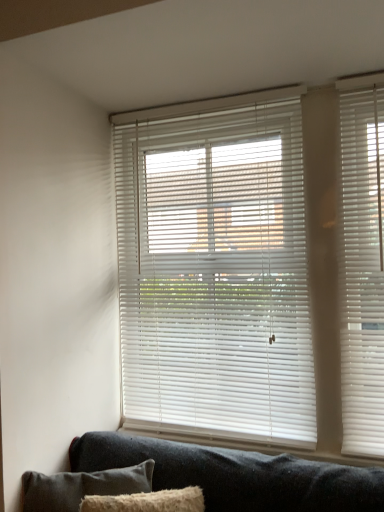
The image size is (384, 512). Describe the element at coordinates (215, 268) in the screenshot. I see `white plastic blinds at center` at that location.

Locate an element on the screen. This screenshot has width=384, height=512. white plastic blinds at center is located at coordinates (215, 268).

Describe the element at coordinates (82, 486) in the screenshot. I see `dark gray fabric pillow at lower left` at that location.

Locate an element on the screen. dark gray fabric pillow at lower left is located at coordinates (82, 486).

This screenshot has width=384, height=512. Identify the location of white plastic blinds at center. (215, 268).

Which is more to the right, dark gray fabric pillow at lower left or white plastic blinds at center?

white plastic blinds at center.

Does dark gray fabric pillow at lower left come behind white plastic blinds at center?

No.

Is point (80, 485) in front of point (231, 274)?

Yes, point (80, 485) is in front of point (231, 274).

From the image's perspective, who appears lower, dark gray fabric pillow at lower left or white plastic blinds at center?

From the image's view, dark gray fabric pillow at lower left is below.

From a real-world perspective, is dark gray fabric pillow at lower left physically above white plastic blinds at center?

Incorrect, from a real-world perspective, dark gray fabric pillow at lower left is lower than white plastic blinds at center.

In terms of width, does dark gray fabric pillow at lower left look wider or thinner when compared to white plastic blinds at center?

Considering their sizes, dark gray fabric pillow at lower left looks broader than white plastic blinds at center.

From their relative heights in the image, would you say dark gray fabric pillow at lower left is taller or shorter than white plastic blinds at center?

dark gray fabric pillow at lower left is shorter than white plastic blinds at center.

Can you confirm if dark gray fabric pillow at lower left is smaller than white plastic blinds at center?

Yes.

Do you think dark gray fabric pillow at lower left is within white plastic blinds at center, or outside of it?

dark gray fabric pillow at lower left cannot be found inside white plastic blinds at center.

Are dark gray fabric pillow at lower left and white plastic blinds at center located far from each other?

No, dark gray fabric pillow at lower left is not far from white plastic blinds at center.

Is dark gray fabric pillow at lower left facing away from white plastic blinds at center?

No, dark gray fabric pillow at lower left is not facing away from white plastic blinds at center.

Can you tell me how much dark gray fabric pillow at lower left and white plastic blinds at center differ in facing direction?

The angle between the facing direction of dark gray fabric pillow at lower left and the facing direction of white plastic blinds at center is 29.1 degrees.

Where is `pillow below the white plastic blinds at center (from the image's perspective)`? The width and height of the screenshot is (384, 512). pillow below the white plastic blinds at center (from the image's perspective) is located at coordinates (82, 486).

Can you confirm if white plastic blinds at center is positioned to the left of dark gray fabric pillow at lower left?

No.

Which is behind, white plastic blinds at center or dark gray fabric pillow at lower left?

white plastic blinds at center is further from the camera.

Which is behind, point (257, 426) or point (30, 480)?

Point (257, 426)

From the image's perspective, is white plastic blinds at center above or below dark gray fabric pillow at lower left?

Clearly, from the image's perspective, white plastic blinds at center is above dark gray fabric pillow at lower left.

From a real-world perspective, between white plastic blinds at center and dark gray fabric pillow at lower left, who is vertically lower?

From a 3D spatial view, dark gray fabric pillow at lower left is below.

Considering the sizes of white plastic blinds at center and dark gray fabric pillow at lower left in the image, is white plastic blinds at center wider or thinner than dark gray fabric pillow at lower left?

Clearly, white plastic blinds at center has less width compared to dark gray fabric pillow at lower left.

Is white plastic blinds at center shorter than dark gray fabric pillow at lower left?

No.

Considering the sizes of white plastic blinds at center and dark gray fabric pillow at lower left in the image, is white plastic blinds at center bigger or smaller than dark gray fabric pillow at lower left?

Considering their sizes, white plastic blinds at center takes up more space than dark gray fabric pillow at lower left.

Consider the image. Is white plastic blinds at center inside or outside of dark gray fabric pillow at lower left?

white plastic blinds at center is outside dark gray fabric pillow at lower left.

Is white plastic blinds at center positioned far away from dark gray fabric pillow at lower left?

No, there isn't a large distance between white plastic blinds at center and dark gray fabric pillow at lower left.

Is white plastic blinds at center looking in the opposite direction of dark gray fabric pillow at lower left?

No, dark gray fabric pillow at lower left is not at the back of white plastic blinds at center.

Can you tell me how much white plastic blinds at center and dark gray fabric pillow at lower left differ in facing direction?

There is a 29.1-degree angle between the facing directions of white plastic blinds at center and dark gray fabric pillow at lower left.

Locate an element on the screen. This screenshot has height=512, width=384. pillow below the white plastic blinds at center (from the image's perspective) is located at coordinates (82, 486).

Identify the location of window blind behind the dark gray fabric pillow at lower left. (215, 268).

I want to click on pillow beneath the white plastic blinds at center (from a real-world perspective), so click(82, 486).